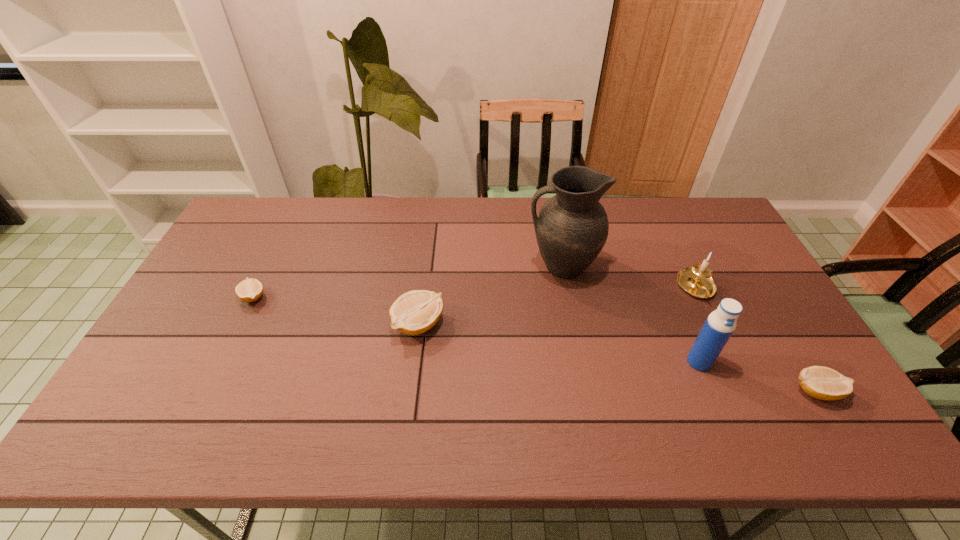
You are a GUI agent. You are given a task and a screenshot of the screen. Output one action in this format:
    pyautogui.click(x=<x>, y=<y>)
    Task: Click on the vacant area that lies between the nearest object and the third object from right to left
    Image resolution: width=960 pixels, height=540 pixels.
    Given the screenshot: What is the action you would take?
    coord(757,376)

Locate which object ranks second in proximity to the fifth object from right to left. Please provide its 2D coordinates. Your answer should be formatted as a tuple, i.e. [(x, y)], where the tuple contains the x and y coordinates of a point satisfying the conditions above.

[(249, 290)]

You are a GUI agent. You are given a task and a screenshot of the screen. Output one action in this format:
    pyautogui.click(x=<x>, y=<y>)
    Task: Click on the object that can be found as the closest to the fourth object from right to left
    This screenshot has height=540, width=960.
    Given the screenshot: What is the action you would take?
    pyautogui.click(x=696, y=280)

Point out which lemon is positioned as the second nearest to the leftmost lemon. Please provide its 2D coordinates. Your answer should be formatted as a tuple, i.e. [(x, y)], where the tuple contains the x and y coordinates of a point satisfying the conditions above.

[(823, 383)]

Find the location of a particular element. the closest lemon to the fifth shortest object is located at coordinates (823, 383).

Find the location of a particular element. The height and width of the screenshot is (540, 960). free location that satisfies the following two spatial constraints: 1. on the side of the pitcher with the handle; 2. on the left side of the third object from right to left is located at coordinates pyautogui.click(x=580, y=362).

This screenshot has width=960, height=540. I want to click on free location that satisfies the following two spatial constraints: 1. on the side of the pitcher with the handle; 2. on the right side of the fourth object from left to right, so click(x=580, y=362).

Find the location of a particular element. free space that satisfies the following two spatial constraints: 1. on the front side of the fifth farthest object; 2. on the left side of the rightmost object is located at coordinates (711, 391).